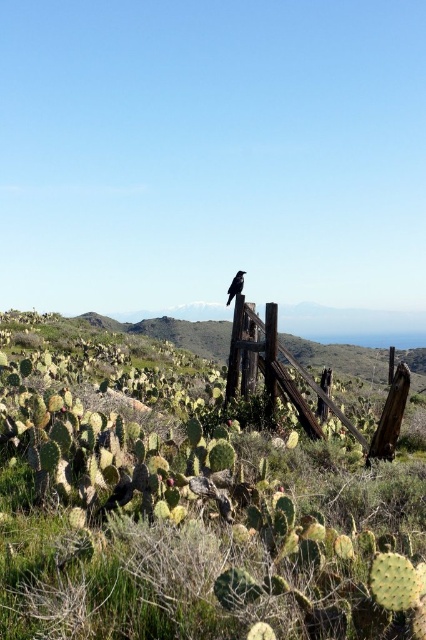
You are standing in the desert scene and want to walk from the point closer to you to the point farther away. Which path would you take between the two points, point (175, 374) and point (229, 291)?

You should walk from point (175, 374) to point (229, 291) because point (175, 374) is closer to you and point (229, 291) is farther away, so this path goes from near to far.

You are a photographer trying to capture a closeup of the black glossy bird at upper center. You need to ensure the green spiny cactus at center is not blocking the view. Based on the scene description, can you determine if the cactus might be wider than the bird, potentially obscuring your shot?

The green spiny cactus at center might be wider than the black glossy bird at upper center, so there is a possibility that the cactus could block the view of the bird.

You are a desert explorer who wants to take a photo of the rusty wood fence at center. To avoid blocking the cactus, should you stand to the right or left of the green spiny cactus at center?

The green spiny cactus at center is to the left of the rusty wood fence at center. To avoid blocking the cactus, you should stand to the right of the green spiny cactus at center so that the fence remains visible behind it.